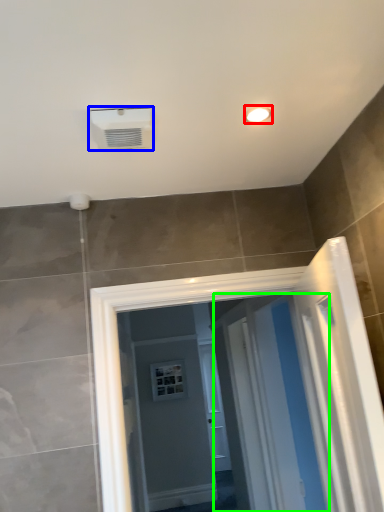
Question: Which is farther away from light fixture (highlighted by a red box)? air conditioning (highlighted by a blue box) or screen door (highlighted by a green box)?

Choices:
 (A) air conditioning
 (B) screen door

Answer: (B)